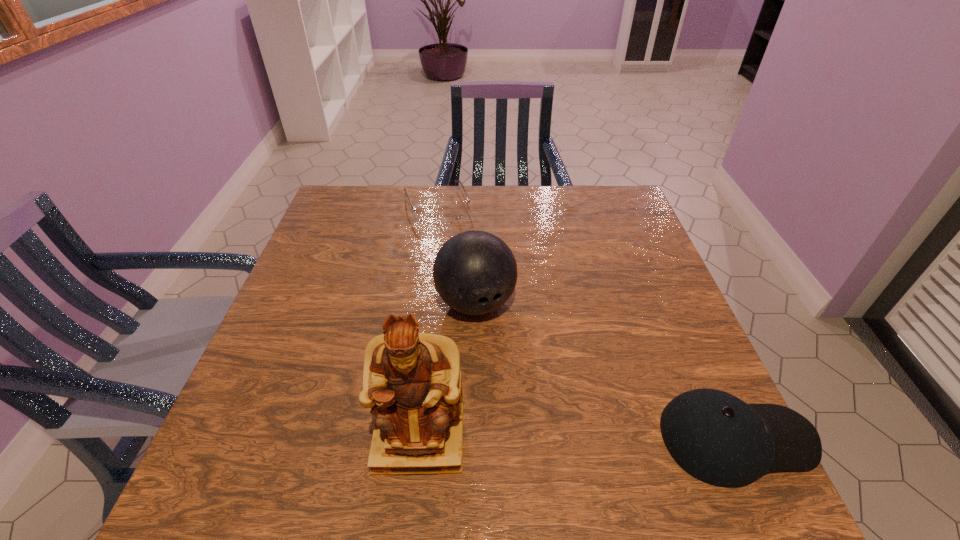
Where is `free space that satisfies the following two spatial constraints: 1. on the front-facing side of the tallest object; 2. on the front-facing side of the baseball cap`? The image size is (960, 540). free space that satisfies the following two spatial constraints: 1. on the front-facing side of the tallest object; 2. on the front-facing side of the baseball cap is located at coordinates [420, 438].